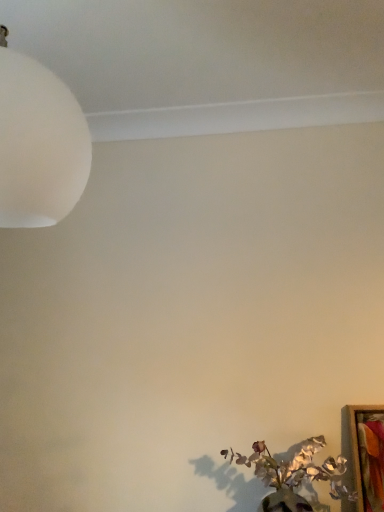
The width and height of the screenshot is (384, 512). Find the location of `metallic silver plant at lower right`. metallic silver plant at lower right is located at coordinates (295, 476).

What do you see at coordinates (295, 476) in the screenshot? Image resolution: width=384 pixels, height=512 pixels. I see `metallic silver plant at lower right` at bounding box center [295, 476].

In order to face metallic silver plant at lower right, should I rotate leftwards or rightwards?

Rotate your view right by about 12.630°.

At what (x,y) coordinates should I click in order to perform the action: click on metallic silver plant at lower right. Please return your answer as a coordinate pair (x, y). The height and width of the screenshot is (512, 384). Looking at the image, I should click on (295, 476).